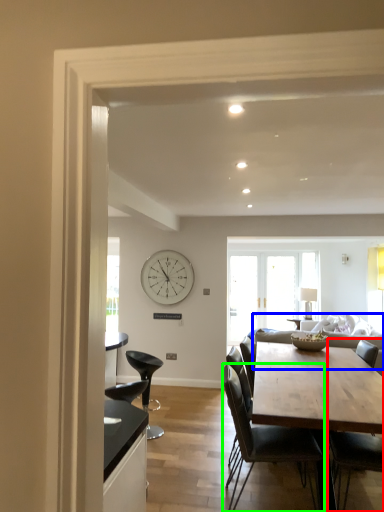
Question: Considering the real-world distances, which object is farthest from chair (highlighted by a red box)? couch (highlighted by a blue box) or chair (highlighted by a green box)?

Choices:
 (A) couch
 (B) chair

Answer: (A)